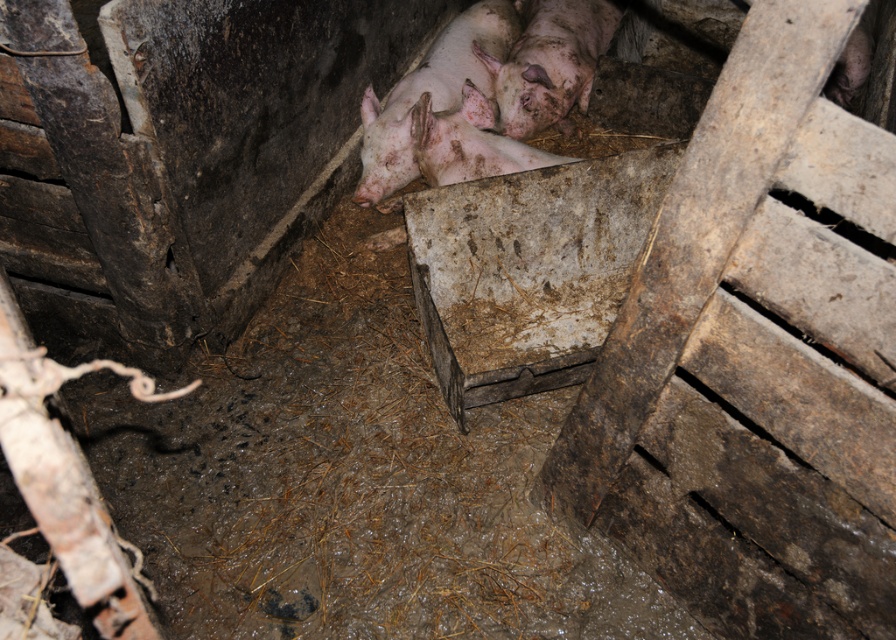
You are a farmer checking on your pigs in the pigsty. You notice two pigs, the pinkish muddy pig at center and the pinkish muddy pig at upper center. Which pig is located directly above the other?

The pinkish muddy pig at upper center is directly above the pinkish muddy pig at center.

From the picture: You are standing outside the pigsty looking in. Which pig, the pinkish muddy pig at center or the pinkish muddy pig at upper center, is closer to you?

The pinkish muddy pig at center is closer to you because it is in front of the pinkish muddy pig at upper center.